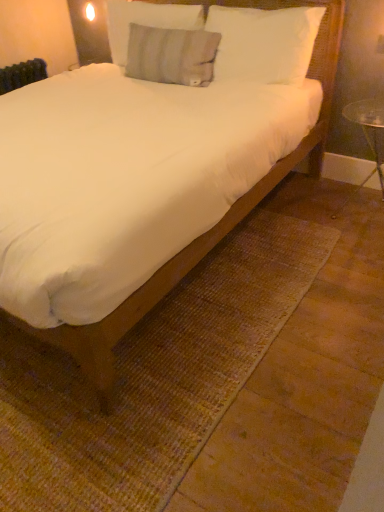
Question: Does white soft pillow at upper center, which ranks as the 3th pillow in left-to-right order, contain gray cotton pillow at upper center, acting as the second pillow starting from the left?

Choices:
 (A) no
 (B) yes

Answer: (A)

Question: Considering the relative sizes of white soft pillow at upper center, positioned as the 1th pillow in right-to-left order, and gray cotton pillow at upper center, acting as the second pillow starting from the left, in the image provided, is white soft pillow at upper center, positioned as the 1th pillow in right-to-left order, smaller than gray cotton pillow at upper center, acting as the second pillow starting from the left,?

Choices:
 (A) yes
 (B) no

Answer: (B)

Question: From the image's perspective, is white soft pillow at upper center, which ranks as the 3th pillow in left-to-right order, on top of gray cotton pillow at upper center, which appears as the second pillow when viewed from the right?

Choices:
 (A) no
 (B) yes

Answer: (A)

Question: Is white soft pillow at upper center, positioned as the 1th pillow in right-to-left order, looking in the opposite direction of gray cotton pillow at upper center, acting as the second pillow starting from the left?

Choices:
 (A) no
 (B) yes

Answer: (A)

Question: Considering the relative sizes of white soft pillow at upper center, positioned as the 1th pillow in right-to-left order, and gray cotton pillow at upper center, acting as the second pillow starting from the left, in the image provided, is white soft pillow at upper center, positioned as the 1th pillow in right-to-left order, wider than gray cotton pillow at upper center, acting as the second pillow starting from the left,?

Choices:
 (A) no
 (B) yes

Answer: (B)

Question: From the image's perspective, relative to white soft bed at center, is white soft pillow at upper center, positioned as the 1th pillow in right-to-left order, above or below?

Choices:
 (A) above
 (B) below

Answer: (A)

Question: From a real-world perspective, relative to white soft bed at center, is white soft pillow at upper center, which ranks as the 3th pillow in left-to-right order, vertically above or below?

Choices:
 (A) below
 (B) above

Answer: (B)

Question: In terms of width, does white soft pillow at upper center, positioned as the 1th pillow in right-to-left order, look wider or thinner when compared to white soft bed at center?

Choices:
 (A) wide
 (B) thin

Answer: (B)

Question: Relative to white soft bed at center, is white soft pillow at upper center, positioned as the 1th pillow in right-to-left order, in front or behind?

Choices:
 (A) front
 (B) behind

Answer: (B)

Question: In the image, is gray cotton pillow at upper center, which appears as the second pillow when viewed from the right, positioned in front of or behind white soft bed at center?

Choices:
 (A) front
 (B) behind

Answer: (B)

Question: Visually, is gray cotton pillow at upper center, acting as the second pillow starting from the left, positioned to the left or to the right of white soft bed at center?

Choices:
 (A) right
 (B) left

Answer: (A)

Question: Would you say gray cotton pillow at upper center, which appears as the second pillow when viewed from the right, is inside or outside white soft bed at center?

Choices:
 (A) inside
 (B) outside

Answer: (A)

Question: Considering the positions of gray cotton pillow at upper center, acting as the second pillow starting from the left, and white soft bed at center in the image, is gray cotton pillow at upper center, acting as the second pillow starting from the left, taller or shorter than white soft bed at center?

Choices:
 (A) tall
 (B) short

Answer: (B)

Question: Is white soft bed at center in front of or behind white soft pillow at upper center, which ranks as the 3th pillow in left-to-right order, in the image?

Choices:
 (A) front
 (B) behind

Answer: (A)

Question: In the image, is white soft bed at center on the left side or the right side of white soft pillow at upper center, which ranks as the 3th pillow in left-to-right order?

Choices:
 (A) right
 (B) left

Answer: (B)